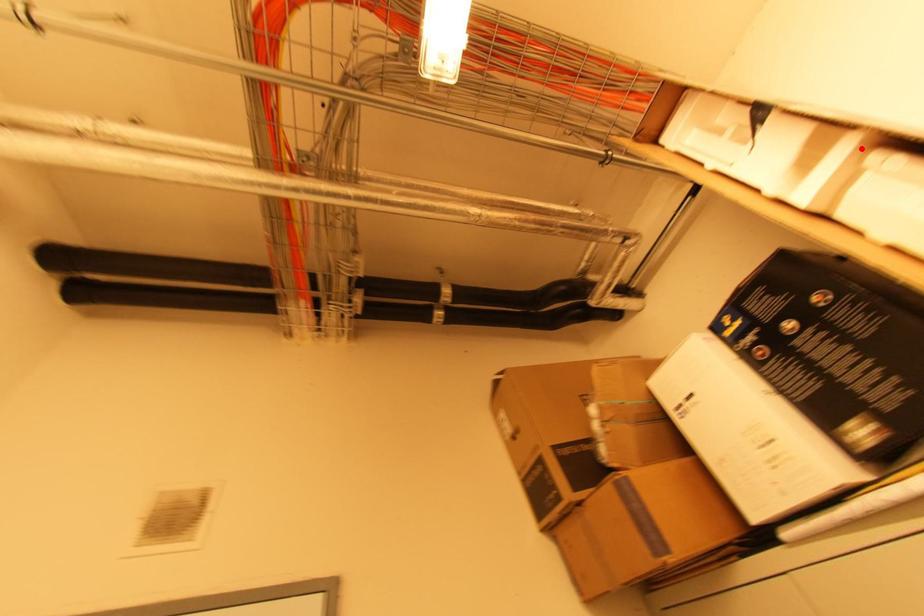
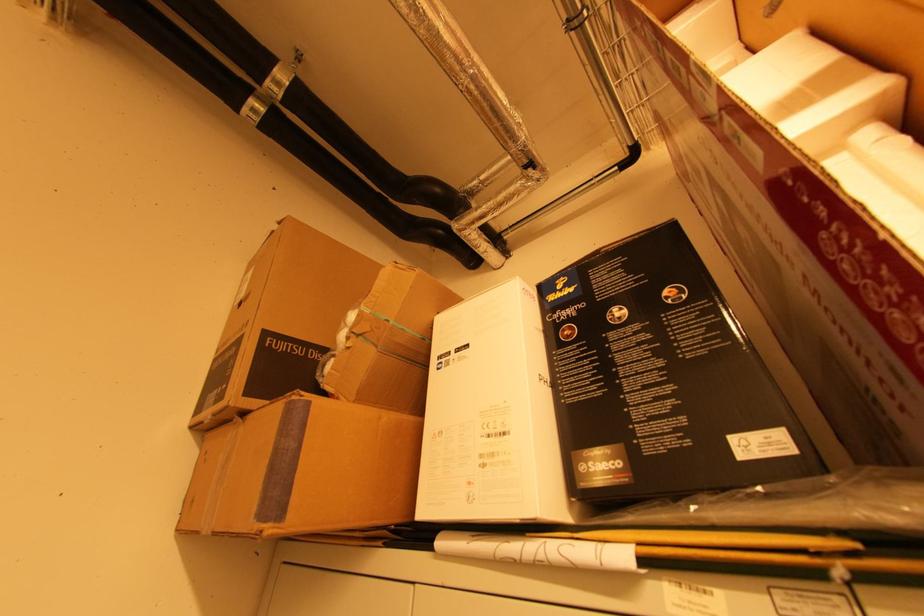
Question: I am providing you with two images of the same scene from different viewpoints. A red point is marked on the first image. Can you still see the location of the red point in image 2?

Choices:
 (A) Yes
 (B) No

Answer: (A)